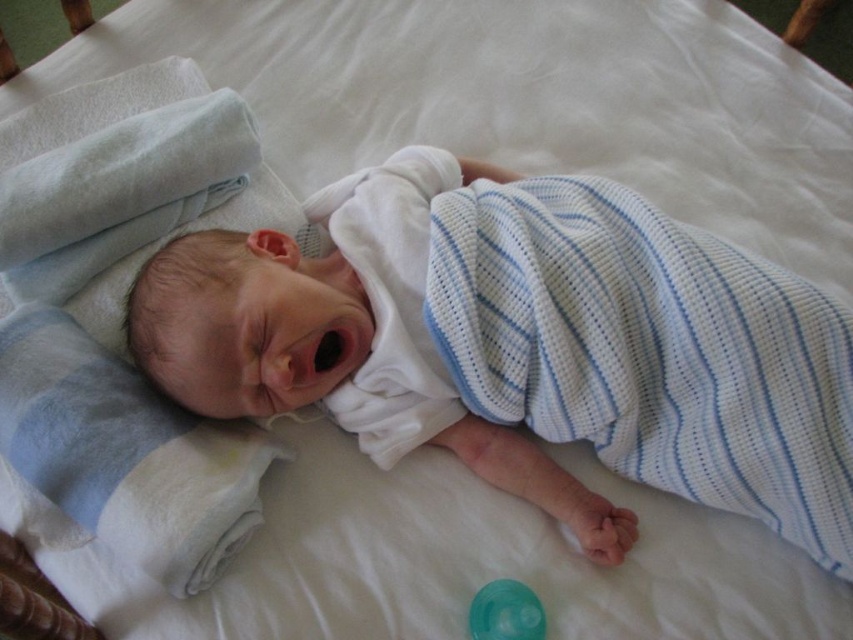
You are a nurse in a hospital nursery. You need to place a small medical kit on the bed near the baby without disturbing them. The medical kit must be placed at a specific coordinate point. Which object in the scene is located at point (120,312)?

The blue striped swaddle at upper left is located at point (120,312).

You are a nurse in a hospital nursery. You need to place the transparent plastic pacifier at center onto the blue striped swaddle at upper left for safekeeping. Is the pacifier small enough to fit entirely on the swaddle?

The blue striped swaddle at upper left is taller than the transparent plastic pacifier at center, so yes, the pacifier can fit entirely on the swaddle.